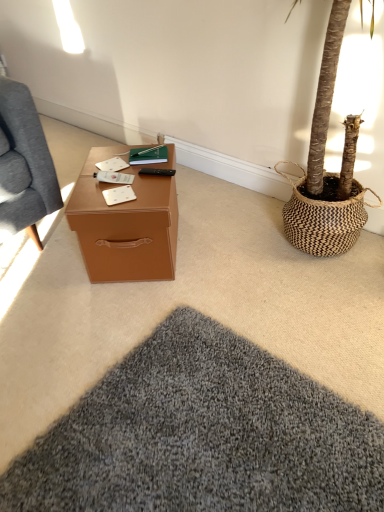
You are a GUI agent. You are given a task and a screenshot of the screen. Output one action in this format:
    pyautogui.click(x=<x>, y=<y>)
    Task: Click on the vacant space to the left of black matte remote control at center
    
    Given the screenshot: What is the action you would take?
    pyautogui.click(x=112, y=184)